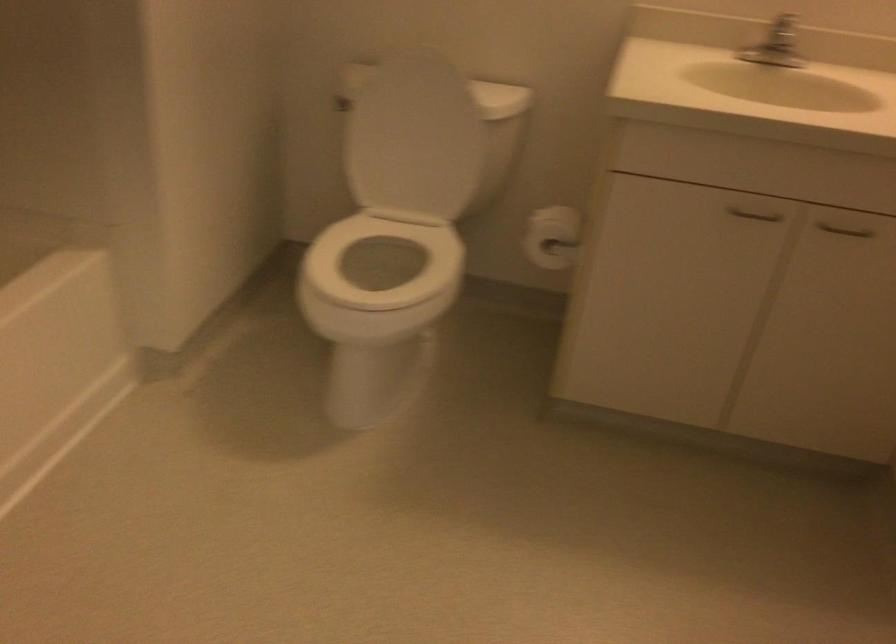
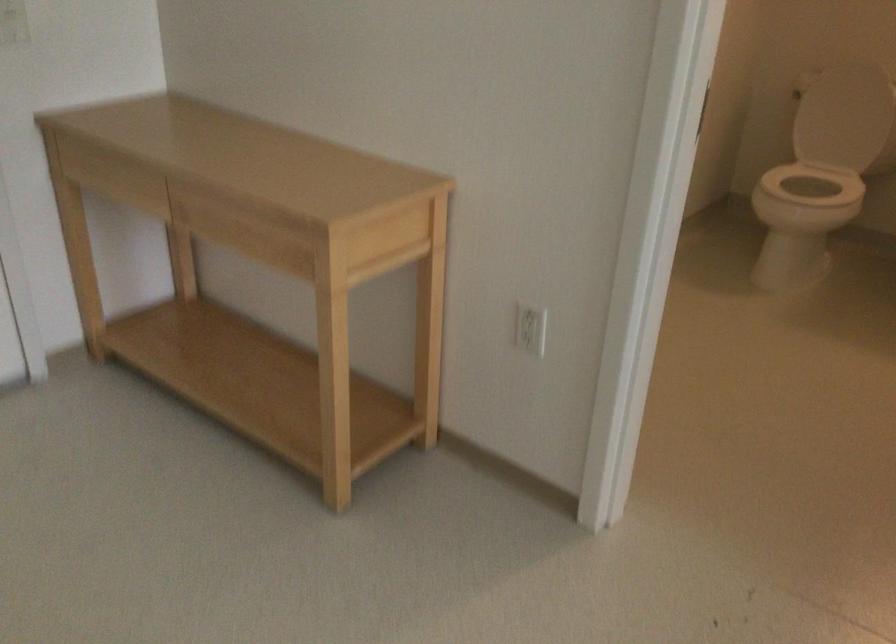
In the second image, find the point that corresponds to (385,167) in the first image.

(839, 118)